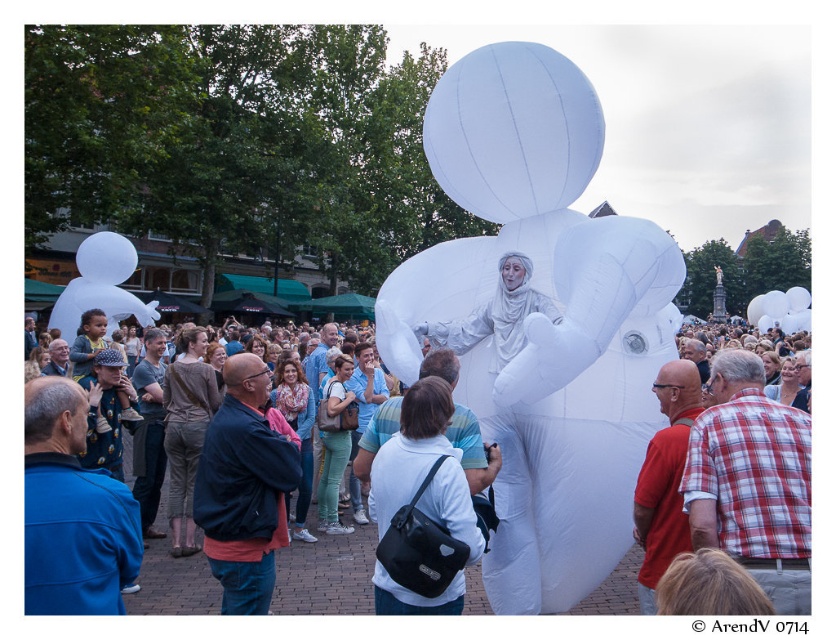
Which is more to the left, white inflatable figure at center or white matte balloon at upper center?

white matte balloon at upper center is more to the left.

Between white inflatable figure at center and white matte balloon at upper center, which one is positioned higher?

white matte balloon at upper center

Find the location of a particular element. The height and width of the screenshot is (640, 836). white inflatable figure at center is located at coordinates (539, 317).

Image resolution: width=836 pixels, height=640 pixels. What do you see at coordinates (539, 317) in the screenshot? I see `white inflatable figure at center` at bounding box center [539, 317].

Does white inflatable figure at center appear on the left side of white matte bag at center?

In fact, white inflatable figure at center is to the right of white matte bag at center.

Who is more forward, (541, 563) or (469, 545)?

Positioned in front is point (469, 545).

This screenshot has width=836, height=640. In order to click on white inflatable figure at center in this screenshot , I will do `click(539, 317)`.

Does white inflatable figure at center have a larger size compared to white matte balloon at left?

No, white inflatable figure at center is not bigger than white matte balloon at left.

Measure the distance from white inflatable figure at center to white matte balloon at left.

The distance of white inflatable figure at center from white matte balloon at left is 162.74 feet.

Between point (636, 342) and point (95, 264), which one is positioned behind?

The point (95, 264) is behind.

Locate an element on the screen. white inflatable figure at center is located at coordinates (539, 317).